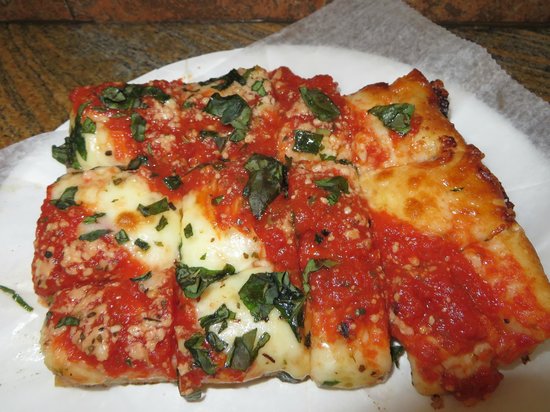
Identify the location of plates. (222, 62), (499, 168), (23, 222), (263, 400).